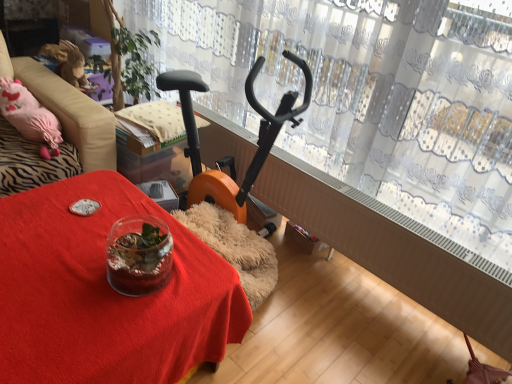
Question: Is transparent lace curtain at upper center aimed at velvet pink cushion at left?

Choices:
 (A) no
 (B) yes

Answer: (B)

Question: Can you confirm if transparent lace curtain at upper center is thinner than velvet pink cushion at left?

Choices:
 (A) no
 (B) yes

Answer: (B)

Question: From the image's perspective, does transparent lace curtain at upper center appear lower than velvet pink cushion at left?

Choices:
 (A) yes
 (B) no

Answer: (B)

Question: Considering the relative sizes of transparent lace curtain at upper center and velvet pink cushion at left in the image provided, is transparent lace curtain at upper center taller than velvet pink cushion at left?

Choices:
 (A) no
 (B) yes

Answer: (B)

Question: From a real-world perspective, is transparent lace curtain at upper center physically below velvet pink cushion at left?

Choices:
 (A) no
 (B) yes

Answer: (A)

Question: Is transparent lace curtain at upper center further to camera compared to velvet pink cushion at left?

Choices:
 (A) no
 (B) yes

Answer: (A)

Question: Considering the relative sizes of translucent glass terrarium at center and transparent lace curtain at upper center in the image provided, is translucent glass terrarium at center taller than transparent lace curtain at upper center?

Choices:
 (A) yes
 (B) no

Answer: (B)

Question: Can you confirm if translucent glass terrarium at center is wider than transparent lace curtain at upper center?

Choices:
 (A) no
 (B) yes

Answer: (B)

Question: Is translucent glass terrarium at center placed right next to transparent lace curtain at upper center?

Choices:
 (A) yes
 (B) no

Answer: (B)

Question: From the image's perspective, is translucent glass terrarium at center over transparent lace curtain at upper center?

Choices:
 (A) no
 (B) yes

Answer: (A)

Question: From the image's perspective, is translucent glass terrarium at center under transparent lace curtain at upper center?

Choices:
 (A) yes
 (B) no

Answer: (A)

Question: Could transparent lace curtain at upper center be considered to be inside translucent glass terrarium at center?

Choices:
 (A) yes
 (B) no

Answer: (B)

Question: From a real-world perspective, is velvet pink cushion at left located beneath translucent glass terrarium at center?

Choices:
 (A) no
 (B) yes

Answer: (A)